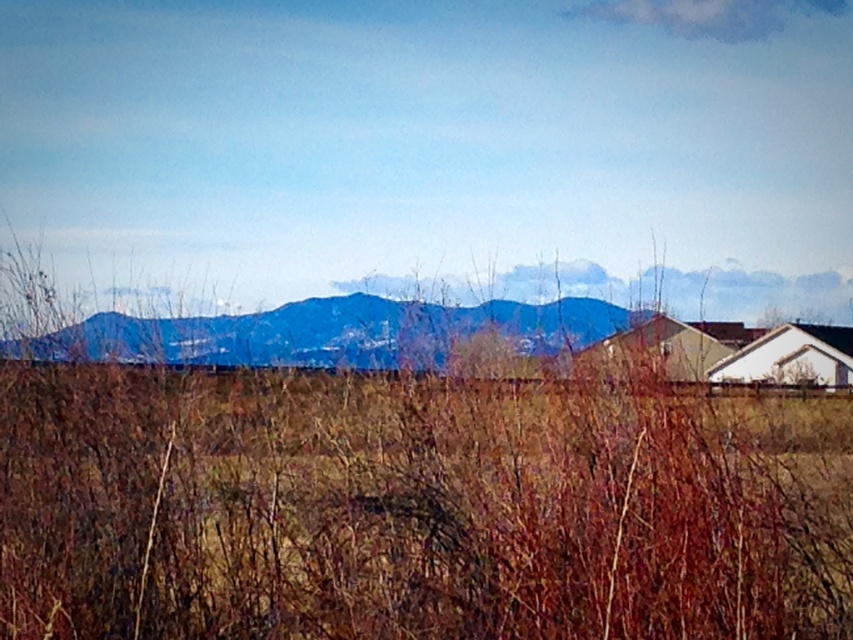
You are a hiker who wants to take a photo of the blue matte mountain range at center. However, you notice the brown dry grass at lower center is blocking your view. Can you determine if the grass is closer to you than the mountains?

The brown dry grass at lower center is in front of the blue matte mountain range at center, so yes, the grass is closer to you and blocking your view of the mountains.

You are a hiker trying to determine the best path to reach the blue matte mountain range at center from your current position near the brown dry grass at lower center. Considering the height difference between them, which direction should you head to avoid obstacles?

The brown dry grass at lower center is taller than the blue matte mountain range at center. Therefore, you should head towards the direction of the blue matte mountain range at center to avoid obstacles caused by the taller grass.

You are an environmental scientist analyzing the landscape. You observe the brown dry grass at lower center and the blue matte mountain range at center. Which object is located to the right of the other?

The brown dry grass at lower center is positioned on the right side of blue matte mountain range at center.